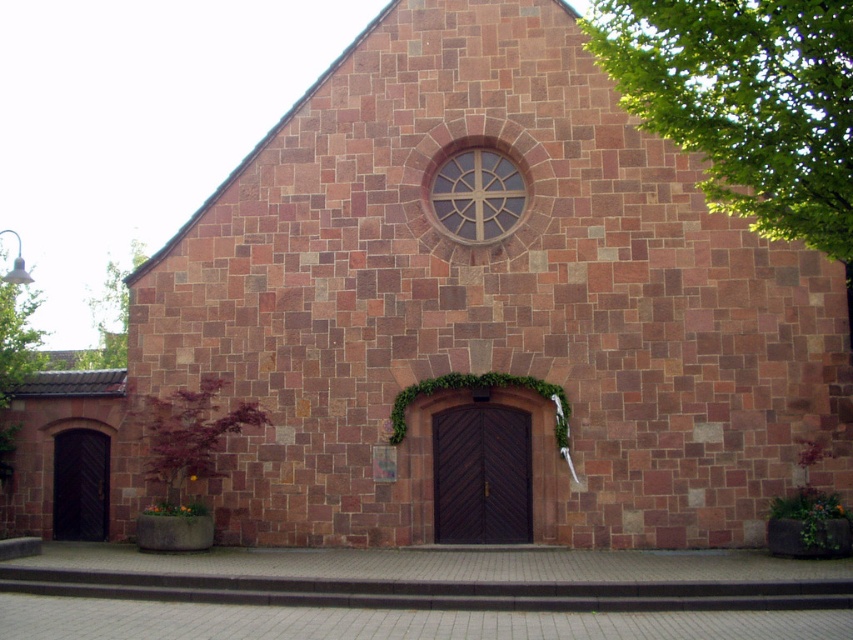
Does green leafy tree at upper right have a greater width compared to green leafy ivy at lower left?

Indeed, green leafy tree at upper right has a greater width compared to green leafy ivy at lower left.

Can you confirm if green leafy tree at upper right is positioned above green leafy ivy at lower left?

Yes, green leafy tree at upper right is above green leafy ivy at lower left.

Which is in front, point (585, 29) or point (183, 440)?

Point (585, 29)

You are a GUI agent. You are given a task and a screenshot of the screen. Output one action in this format:
    pyautogui.click(x=<x>, y=<y>)
    Task: Click on the green leafy tree at upper right
    
    Given the screenshot: What is the action you would take?
    pyautogui.click(x=746, y=102)

The width and height of the screenshot is (853, 640). What do you see at coordinates (746, 102) in the screenshot?
I see `green leafy tree at upper right` at bounding box center [746, 102].

Who is more distant from viewer, (711, 196) or (85, 364)?

The point (85, 364) is behind.

Consider the image. Measure the distance between point (804, 168) and camera.

Point (804, 168) is 20.08 meters away from camera.

You are a GUI agent. You are given a task and a screenshot of the screen. Output one action in this format:
    pyautogui.click(x=<x>, y=<y>)
    Task: Click on the green leafy tree at upper right
    The width and height of the screenshot is (853, 640).
    Given the screenshot: What is the action you would take?
    pyautogui.click(x=746, y=102)

Does point (171, 477) lie in front of point (115, 365)?

Yes, point (171, 477) is closer to viewer.

Which is in front, point (178, 468) or point (107, 344)?

Point (178, 468) is more forward.

The height and width of the screenshot is (640, 853). What do you see at coordinates (189, 435) in the screenshot? I see `green leafy ivy at lower left` at bounding box center [189, 435].

In order to click on green leafy ivy at lower left in this screenshot , I will do `click(189, 435)`.